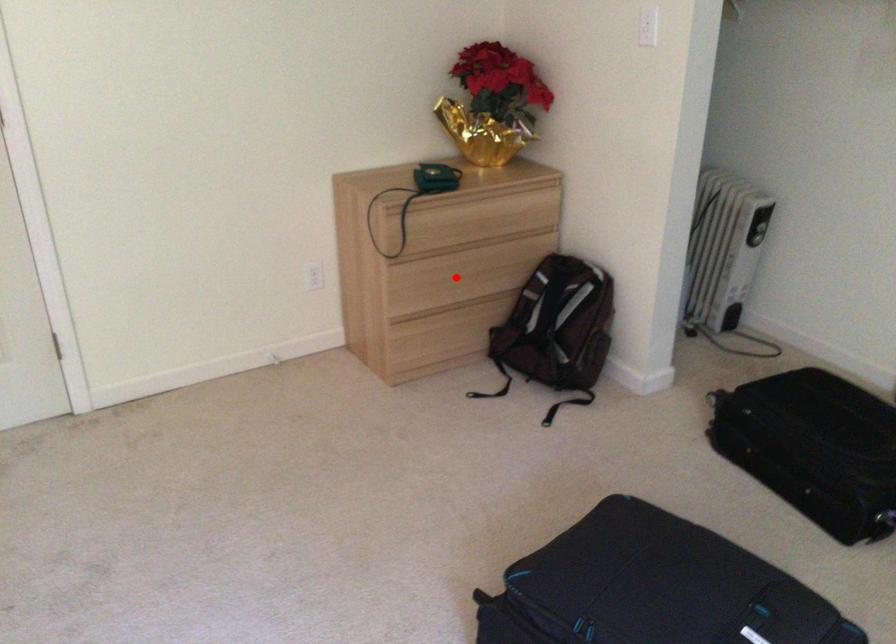
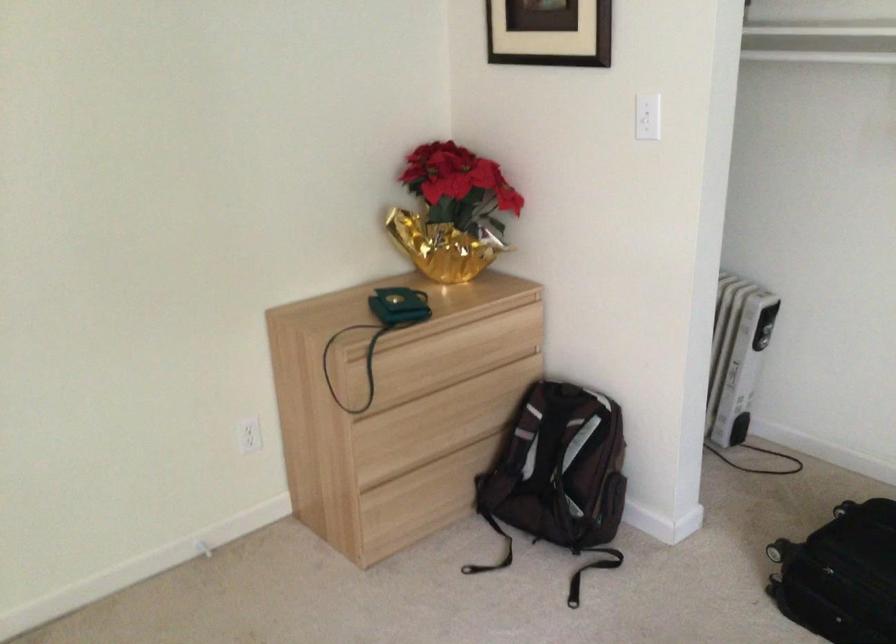
Question: I am providing you with two images of the same scene from different viewpoints. Given a red point in image1, look at the same physical point in image2. Is it:

Choices:
 (A) Closer to the viewpoint
 (B) Farther from the viewpoint

Answer: (A)